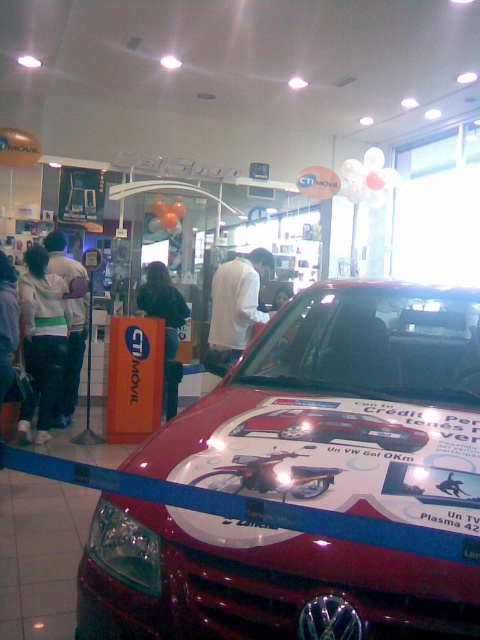
Question: Can you confirm if white fleece jacket at left is positioned above white matte shirt at center?

Choices:
 (A) no
 (B) yes

Answer: (A)

Question: In this image, where is white matte shirt at center located relative to dark fabric jacket at center?

Choices:
 (A) above
 (B) below

Answer: (A)

Question: Which is farther from the white fleece jacket at left?

Choices:
 (A) dark fabric jacket at center
 (B) white matte shirt at center

Answer: (B)

Question: Can you confirm if white fleece jacket at left is positioned to the right of white hoodie at center?

Choices:
 (A) no
 (B) yes

Answer: (A)

Question: Among these objects, which one is nearest to the camera?

Choices:
 (A) glossy red car at center
 (B) white matte shirt at center
 (C) dark fabric jacket at center

Answer: (A)

Question: Considering the real-world distances, which object is closest to the dark gray hoodie at left?

Choices:
 (A) dark fabric jacket at center
 (B) glossy red car at center
 (C) white matte shirt at center
 (D) white hoodie at center

Answer: (D)